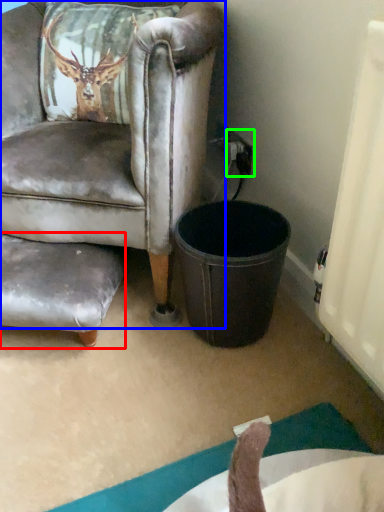
Question: Which is nearer to the swivel chair (highlighted by a red box)? chair (highlighted by a blue box) or power outlet (highlighted by a green box).

Choices:
 (A) chair
 (B) power outlet

Answer: (A)